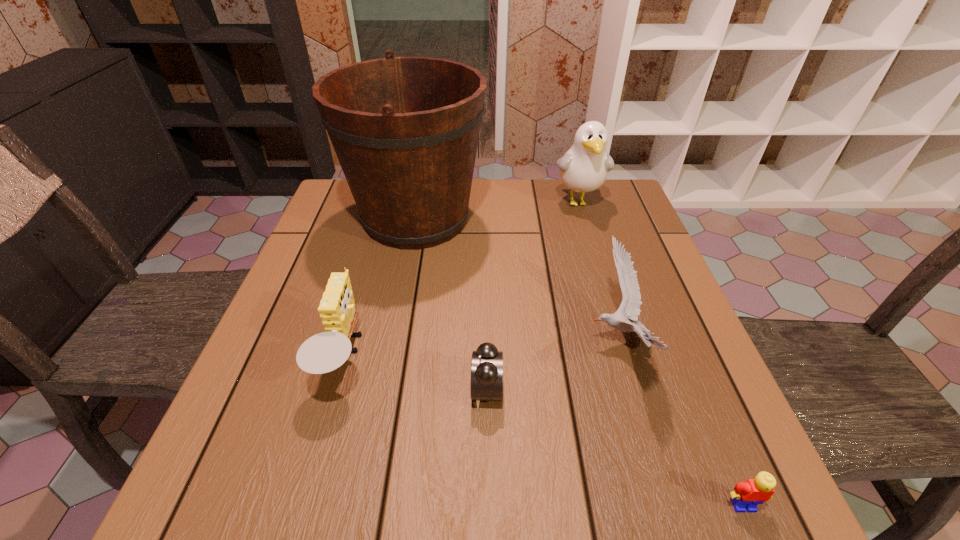
Identify the location of bucket situated at the left edge. (405, 130).

I want to click on sponge that is positioned at the left edge, so click(x=324, y=352).

Identify the location of Lego that is at the right edge. This screenshot has height=540, width=960. (747, 495).

Image resolution: width=960 pixels, height=540 pixels. Find the location of `object present at the far left corner`. object present at the far left corner is located at coordinates (405, 130).

Find the location of a particular element. This screenshot has height=540, width=960. object that is at the far right corner is located at coordinates (584, 168).

The width and height of the screenshot is (960, 540). Find the location of `object at the near right corner`. object at the near right corner is located at coordinates (747, 495).

In the image, there is a desktop. Identify the location of free space at the far edge. Image resolution: width=960 pixels, height=540 pixels. (543, 200).

Find the location of `free region at the near edge of the desktop`. free region at the near edge of the desktop is located at coordinates (317, 462).

Image resolution: width=960 pixels, height=540 pixels. Find the location of `free region at the left edge of the desktop`. free region at the left edge of the desktop is located at coordinates (356, 245).

The height and width of the screenshot is (540, 960). In order to click on vacant position at the right edge of the desktop in this screenshot , I will do `click(688, 364)`.